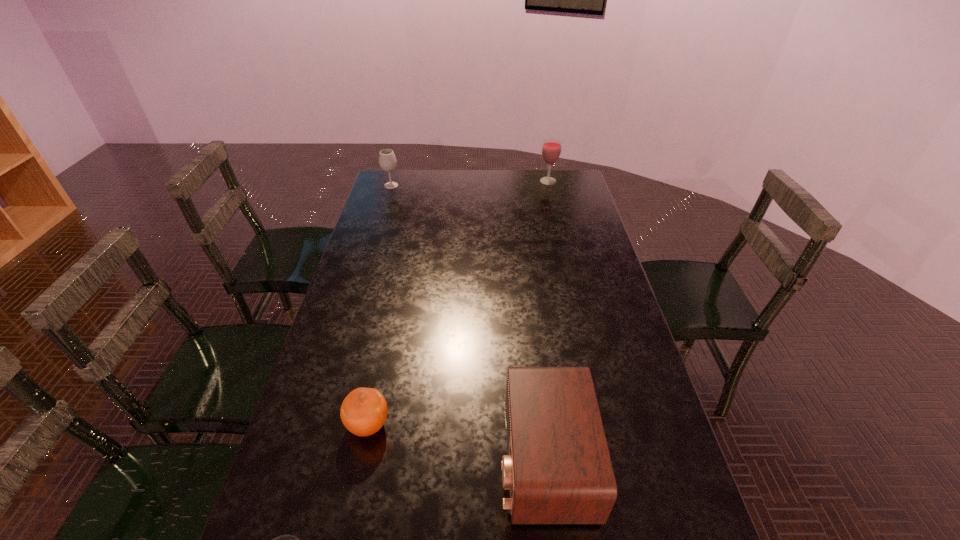
You are a GUI agent. You are given a task and a screenshot of the screen. Output one action in this format:
    pyautogui.click(x=<x>, y=<y>)
    Task: Click on the free spot between the orange and the second object from right to left
    The height and width of the screenshot is (540, 960).
    Given the screenshot: What is the action you would take?
    point(457,442)

This screenshot has width=960, height=540. What are the coordinates of `free point between the rightmost wineglass and the shortest object` in the screenshot? It's located at (458, 303).

At what (x,y) coordinates should I click in order to perform the action: click on vacant space that's between the orange and the rightmost wineglass. Please return your answer as a coordinate pair (x, y). Looking at the image, I should click on (458, 303).

Locate an element on the screen. free spot between the shortest object and the rightmost wineglass is located at coordinates (458, 303).

At what (x,y) coordinates should I click in order to perform the action: click on object that is the third closest to the orange. Please return your answer as a coordinate pair (x, y). This screenshot has height=540, width=960. Looking at the image, I should click on (387, 160).

What are the coordinates of `object that is the second nearest to the rightmost object` in the screenshot? It's located at (558, 470).

Locate which wineglass ranks second in proximity to the rightmost wineglass. Please provide its 2D coordinates. Your answer should be formatted as a tuple, i.e. [(x, y)], where the tuple contains the x and y coordinates of a point satisfying the conditions above.

[(286, 539)]

Locate an element on the screen. Image resolution: width=960 pixels, height=540 pixels. wineglass that can be found as the closest to the radio receiver is located at coordinates (286, 539).